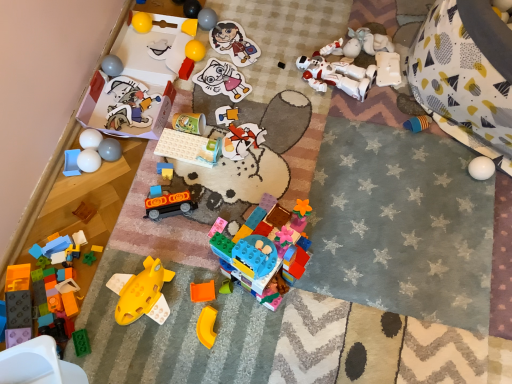
Where is `free space behind white plastic robot at upper right, which appears as the second toy when viewed from the right`? This screenshot has height=384, width=512. free space behind white plastic robot at upper right, which appears as the second toy when viewed from the right is located at coordinates (375, 34).